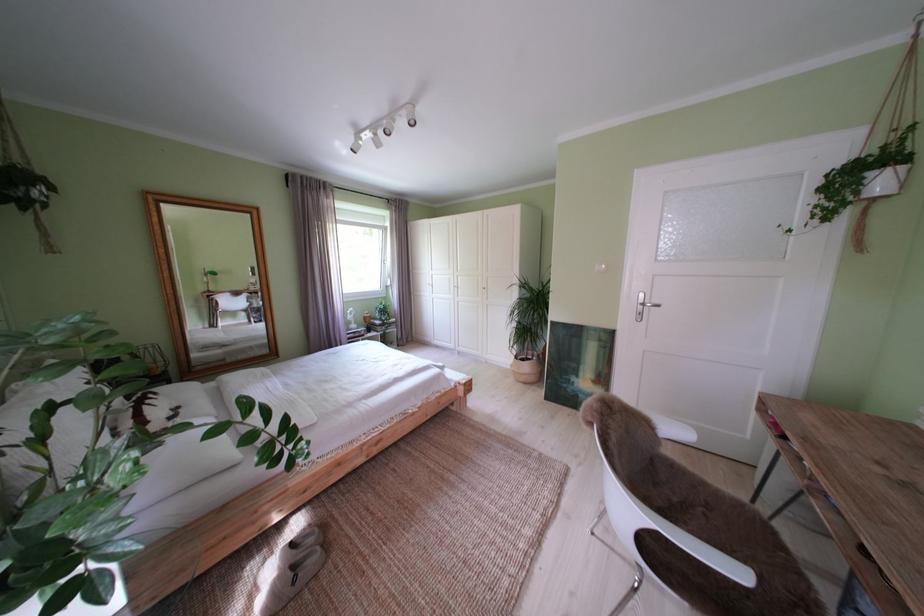
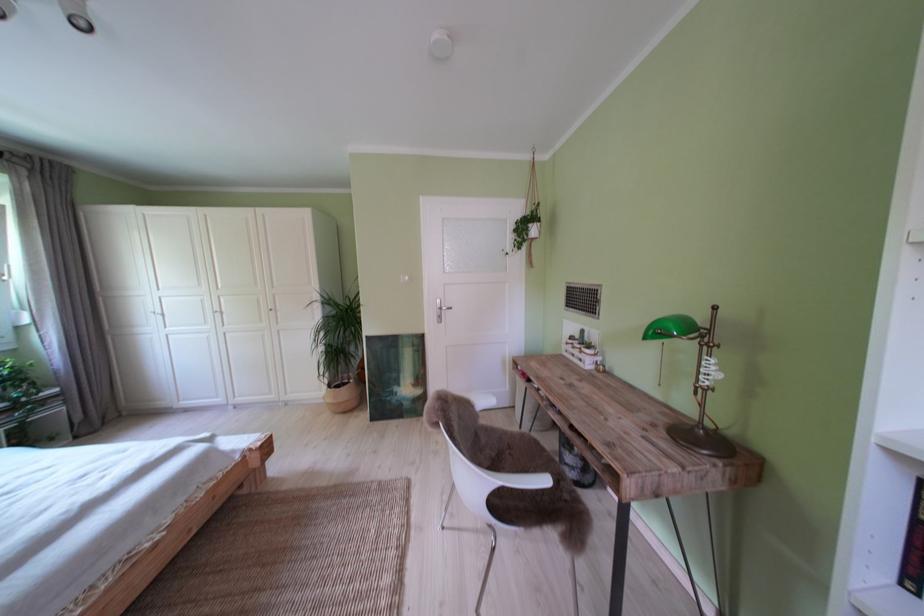
Where in the second image is the point corresponding to point (715, 521) from the first image?

(521, 459)